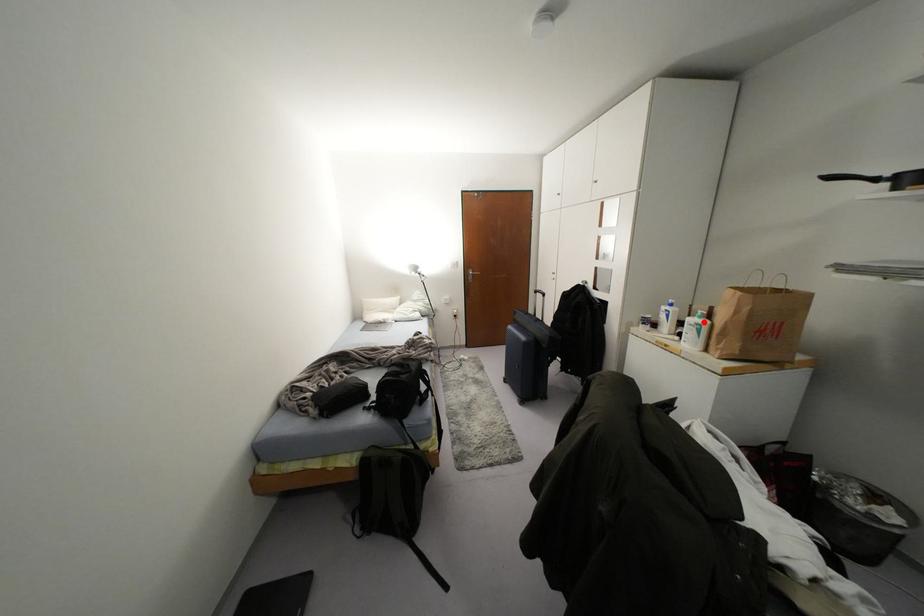
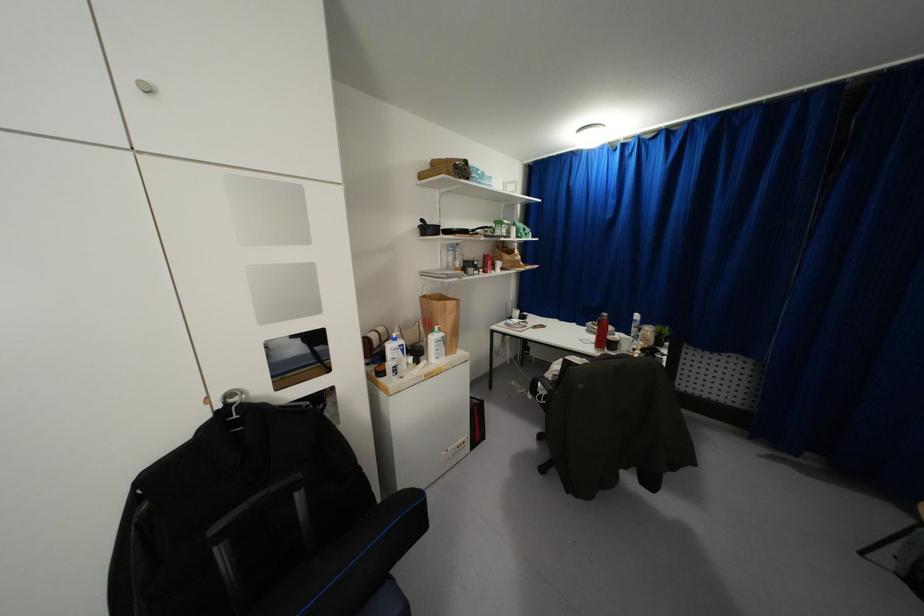
Question: I am providing you with two images of the same scene from different viewpoints. In image1, a red point is highlighted. Considering the same 3D point in image2, which of the following is correct?

Choices:
 (A) It is closer
 (B) It is farther

Answer: (B)